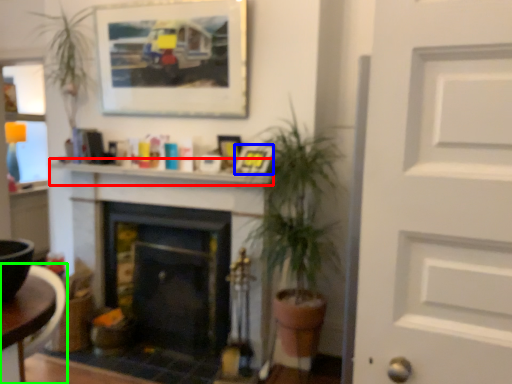
Question: Which is farther away from mantle (highlighted by a red box)? picture frame (highlighted by a blue box) or table (highlighted by a green box)?

Choices:
 (A) picture frame
 (B) table

Answer: (B)